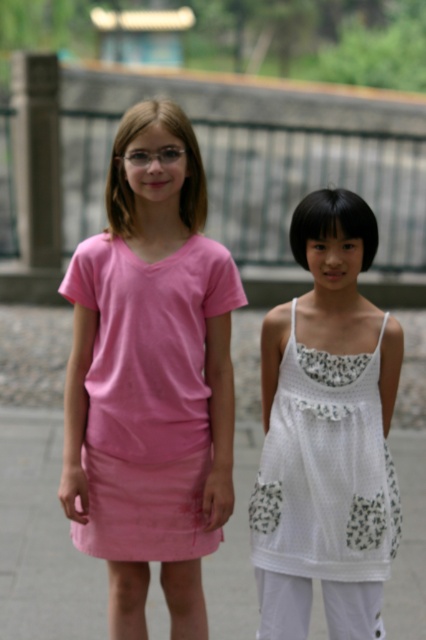
Between matte pink dress at center and white crochet dress at center, which one appears on the right side from the viewer's perspective?

Positioned to the right is white crochet dress at center.

Locate an element on the screen. The image size is (426, 640). matte pink dress at center is located at coordinates (149, 396).

Based on the photo, how much distance is there between pink fabric skirt at lower center and white crochet dress at center?

pink fabric skirt at lower center is 5.46 feet away from white crochet dress at center.

Is pink fabric skirt at lower center above white crochet dress at center?

Actually, pink fabric skirt at lower center is below white crochet dress at center.

Which is behind, point (13, 593) or point (353, 557)?

The point (13, 593) is more distant.

Find the location of `pink fabric skirt at lower center`. pink fabric skirt at lower center is located at coordinates 42,540.

Is matte pink dress at center below pink fabric skirt at lower center?

No.

Does matte pink dress at center have a smaller size compared to pink fabric skirt at lower center?

Indeed, matte pink dress at center has a smaller size compared to pink fabric skirt at lower center.

Where is `matte pink dress at center`? The width and height of the screenshot is (426, 640). matte pink dress at center is located at coordinates (149, 396).

Locate an element on the screen. matte pink dress at center is located at coordinates (149, 396).